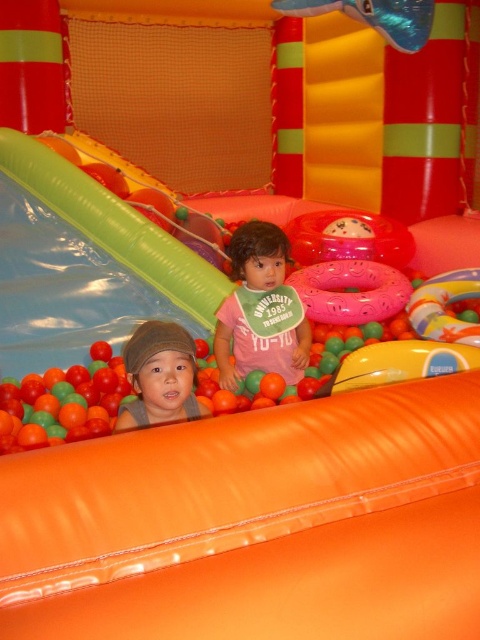
Between matte gray cap at center and matte pink shirt at center, which one has more height?

Standing taller between the two is matte pink shirt at center.

Is point (187, 390) closer to camera compared to point (220, 324)?

That is True.

Where is `matte gray cap at center`? matte gray cap at center is located at coordinates (159, 376).

Between green plastic slide at upper left and matte pink shirt at center, which one appears on the right side from the viewer's perspective?

Positioned to the right is matte pink shirt at center.

Who is more distant from viewer, (x=215, y=301) or (x=266, y=278)?

The point (x=215, y=301) is more distant.

I want to click on green plastic slide at upper left, so click(115, 227).

Between orange matte ball pit at lower left and matte gray cap at center, which one is positioned higher?

matte gray cap at center is higher up.

Does point (0, 401) come farther from viewer compared to point (168, 358)?

Yes, it is behind point (168, 358).

You are a GUI agent. You are given a task and a screenshot of the screen. Output one action in this format:
    pyautogui.click(x=<x>, y=<y>)
    Task: Click on the orange matte ball pit at lower left
    This screenshot has width=480, height=640.
    Given the screenshot: What is the action you would take?
    pyautogui.click(x=62, y=403)